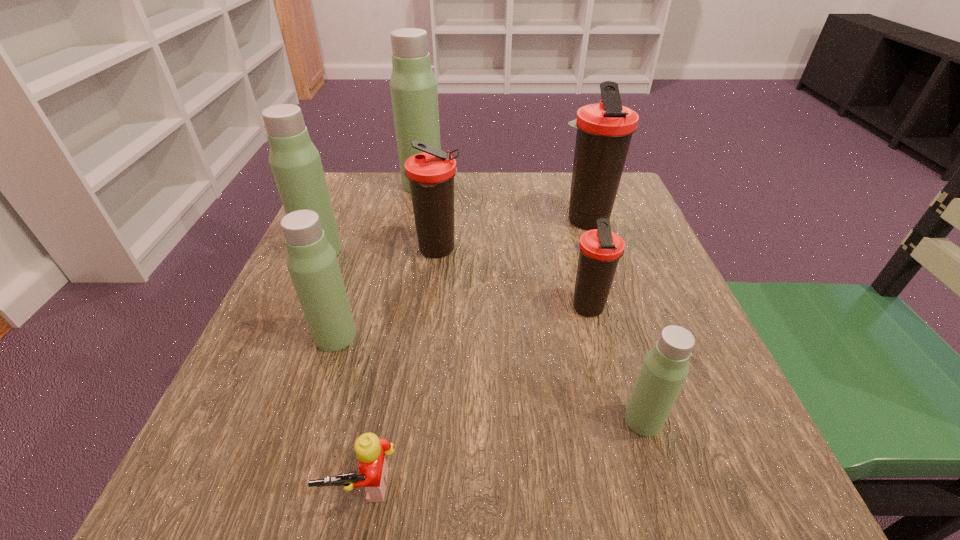
You are a GUI agent. You are given a task and a screenshot of the screen. Output one action in this format:
    pyautogui.click(x=<x>, y=<y>)
    Task: Click on the farthest thermos bottle
    Image resolution: width=960 pixels, height=540 pixels.
    Given the screenshot: What is the action you would take?
    pyautogui.click(x=413, y=86)

Identify the location of the farthest object. The image size is (960, 540). (413, 86).

Image resolution: width=960 pixels, height=540 pixels. Identify the location of the biggest brown thermos bottle. (604, 130).

Find the location of a particular element. This screenshot has height=540, width=960. the leftmost light thermos bottle is located at coordinates (295, 162).

What are the coordinates of `the third nearest light thermos bottle` in the screenshot? It's located at (295, 162).

You are a GUI agent. You are given a task and a screenshot of the screen. Output one action in this format:
    pyautogui.click(x=<x>, y=<y>)
    Task: Click on the second smallest brown thermos bottle
    The image size is (960, 540).
    Given the screenshot: What is the action you would take?
    pyautogui.click(x=431, y=174)

Identify the location of the second light thermos bottle from left to right. (312, 262).

The height and width of the screenshot is (540, 960). Find the location of `the seventh object from right to left`. the seventh object from right to left is located at coordinates (312, 262).

This screenshot has height=540, width=960. What are the coordinates of `the rightmost light thermos bottle` in the screenshot? It's located at (665, 368).

The height and width of the screenshot is (540, 960). Identify the location of the nearest light thermos bottle. (665, 368).